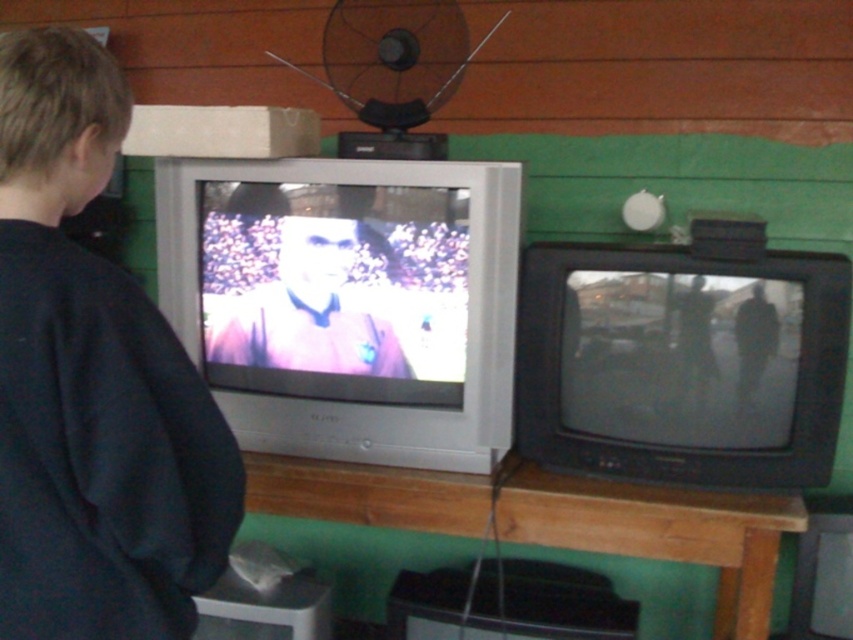
You are holding a 1 meter long pole. If you want to reach the dark blue sweatshirt at left from your current position, will the pole be long enough?

The distance between you and the dark blue sweatshirt at left is 83.89 centimeters. Since the pole is 1 meter long, which is longer than the distance, the pole will be long enough to reach the sweatshirt.

You are organizing a closet and see the dark blue sweatshirt at left and the matte black shirt at center. Which clothing item is positioned more to the left side?

The dark blue sweatshirt at left is positioned more to the left side than the matte black shirt at center.